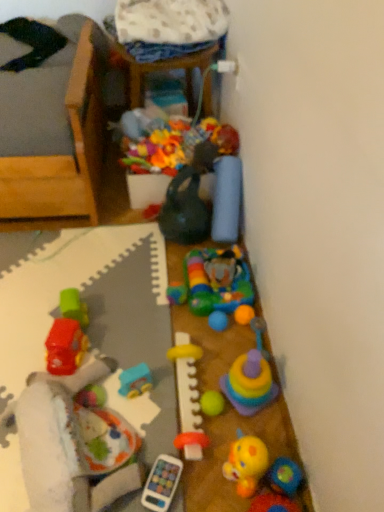
At what (x,y) coordinates should I click in order to perform the action: click on vacant space that is in between green rubber ball at center, which appears as the 5th toy when viewed from the left, and blue plastic toy car at center, positioned as the tenth toy in right-to-left order. Please return your answer as a coordinate pair (x, y). The width and height of the screenshot is (384, 512). Looking at the image, I should click on (178, 395).